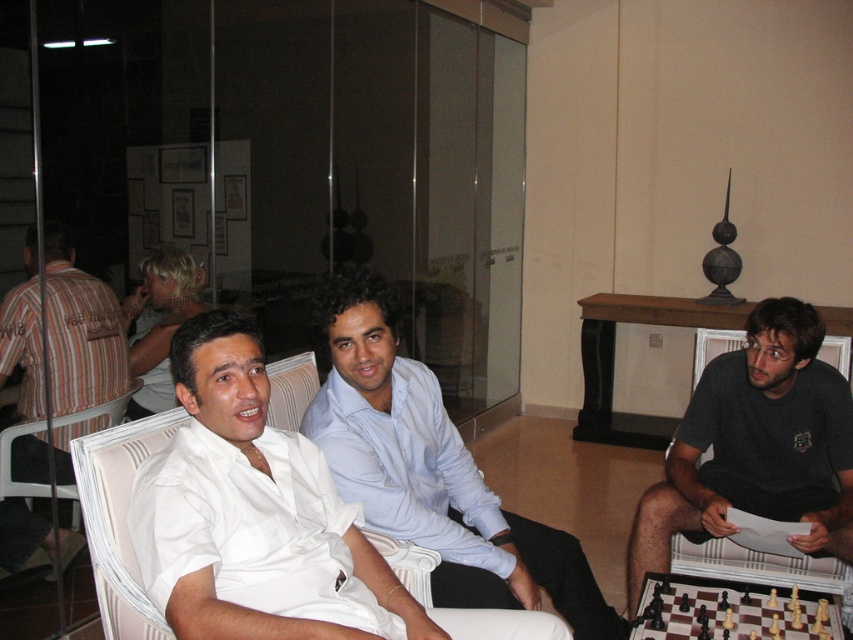
Question: Which object appears closest to the camera in this image?

Choices:
 (A) dark gray t-shirt at lower right
 (B) striped cotton shirt at left
 (C) white fabric armchair at left

Answer: (A)

Question: Does light blue shirt at center have a smaller size compared to dark gray t-shirt at lower right?

Choices:
 (A) no
 (B) yes

Answer: (A)

Question: Does dark gray t-shirt at lower right appear over wooden chess set at lower right?

Choices:
 (A) no
 (B) yes

Answer: (B)

Question: Which of the following is the farthest from the observer?

Choices:
 (A) (459, 534)
 (B) (38, 432)

Answer: (B)

Question: Is light blue shirt at center smaller than dark gray t-shirt at lower right?

Choices:
 (A) no
 (B) yes

Answer: (A)

Question: Which of the following is the farthest from the observer?

Choices:
 (A) (349, 440)
 (B) (93, 413)

Answer: (B)